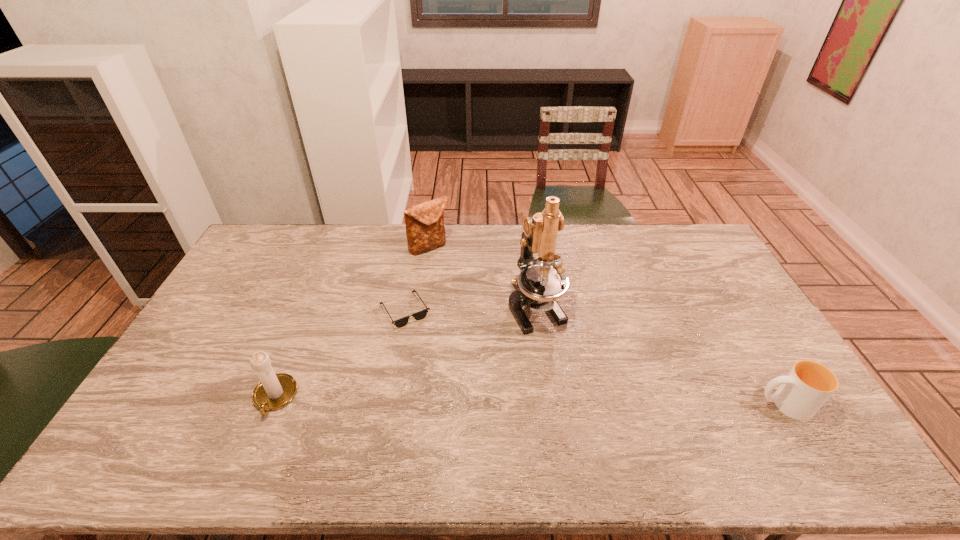
Find the location of a particular element. candle holder is located at coordinates (274, 391).

The width and height of the screenshot is (960, 540). Find the location of `the second shortest object`. the second shortest object is located at coordinates (806, 388).

I want to click on the rightmost object, so click(x=806, y=388).

I want to click on the second object from right to left, so click(x=541, y=281).

Identify the location of microscope. The image size is (960, 540). (541, 281).

This screenshot has height=540, width=960. In order to click on clutch bag in this screenshot , I will do `click(425, 230)`.

Identify the location of sunglasses. (420, 315).

Image resolution: width=960 pixels, height=540 pixels. I want to click on free space located with the handle on the side of the fourth tallest object, so click(643, 404).

Find the location of `free space located 0.310m with the handle on the side of the fourth tallest object`. free space located 0.310m with the handle on the side of the fourth tallest object is located at coordinates (639, 404).

This screenshot has width=960, height=540. Find the location of `free spot located 0.210m with the handle on the side of the fourth tallest object`. free spot located 0.210m with the handle on the side of the fourth tallest object is located at coordinates (677, 404).